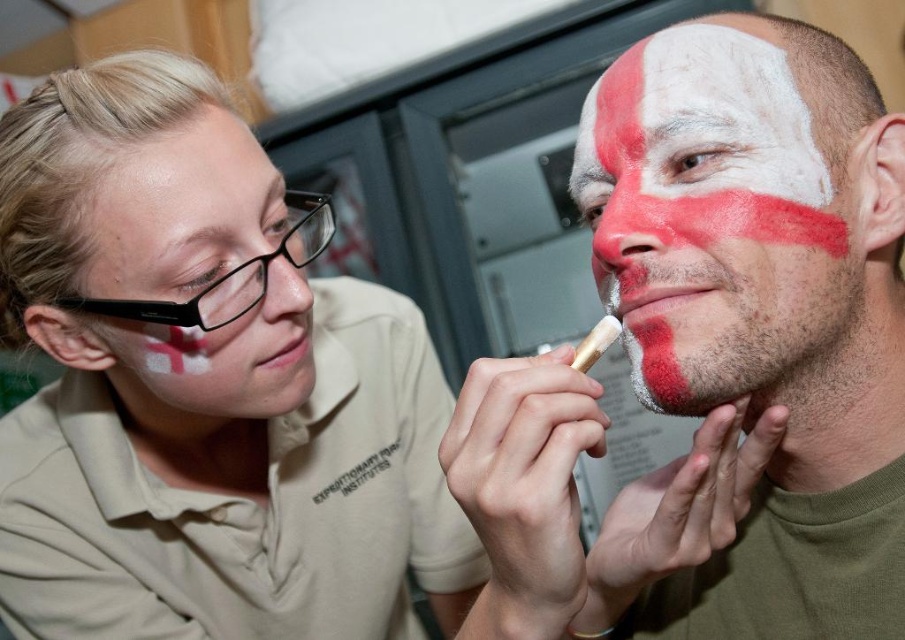
You are an artist preparing to apply face paint for a theatrical performance. You have two containers of white matte face paint. One is labeled as white matte face paint at center and the other as matte white face paint at upper left. According to the image, which container is located higher up?

The white matte face paint at center is positioned over matte white face paint at upper left, meaning the matte white face paint at upper left is higher up.

You are an artist setting up your workspace. You have a white matte paint at center and a matte gold paintbrush at lower center. Which object is closer to you?

The white matte paint at center is closer to you because the matte gold paintbrush at lower center is behind it.

You are an artist preparing to paint a large canvas. You have the white matte paint at center and the matte gold paintbrush at lower center available. Which item should you choose if you need a tool to apply paint?

The matte gold paintbrush at lower center is the tool to apply paint, while the white matte paint at center is the paint itself. Since you need a tool, choose the matte gold paintbrush at lower center.